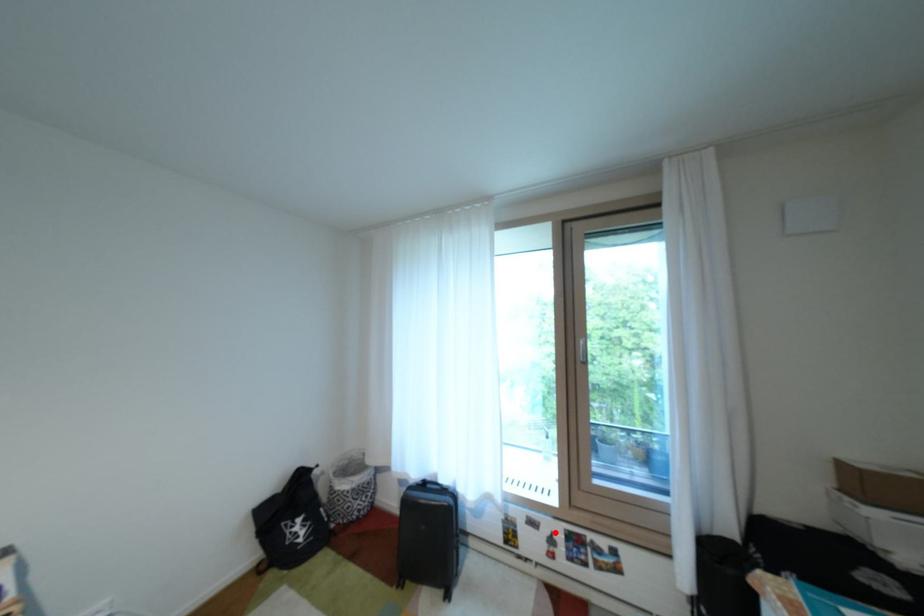
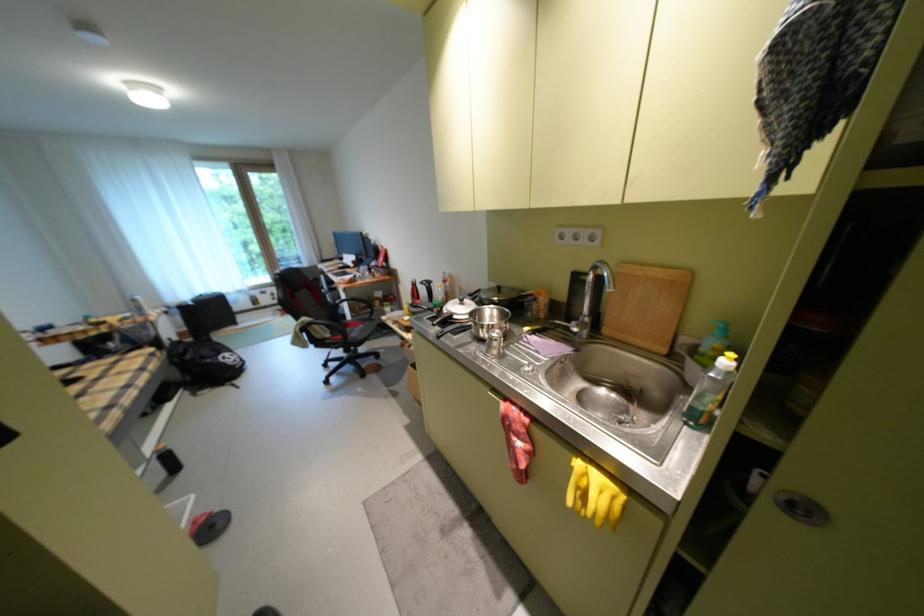
Find the pixel in the second image that matches the highlighted location in the first image.

(280, 294)